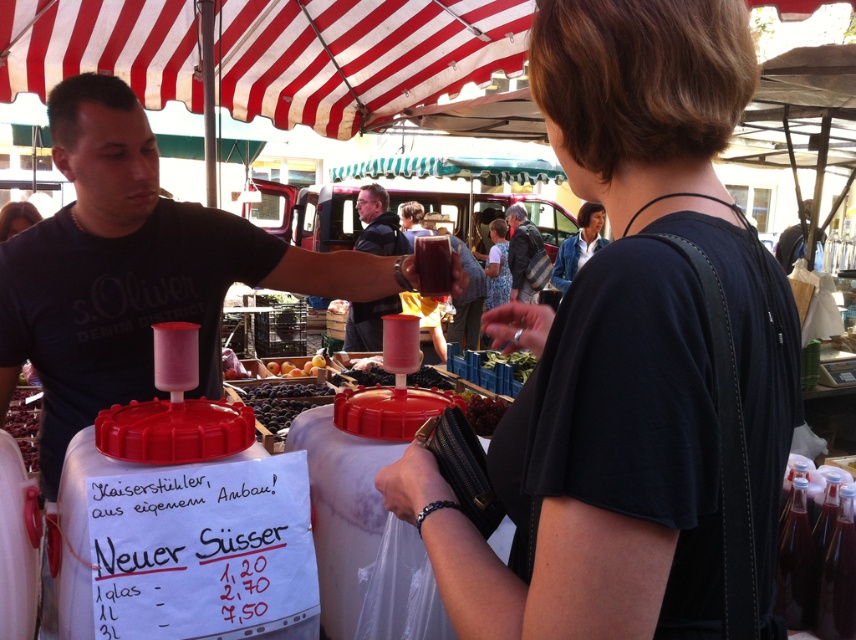
Question: Which of the following is the closest to the observer?

Choices:
 (A) dark purple grapes at center
 (B) smooth yellow peaches at center
 (C) matte black shirt at upper left

Answer: (A)

Question: Does dark blue t-shirt at center appear over matte black shirt at upper left?

Choices:
 (A) no
 (B) yes

Answer: (B)

Question: Is matte black t-shirt at center below dark purple grapes at center?

Choices:
 (A) no
 (B) yes

Answer: (A)

Question: Is dark purple grapes at center to the left of green leafy vegetable at center from the viewer's perspective?

Choices:
 (A) yes
 (B) no

Answer: (A)

Question: Which point is closer to the camera?

Choices:
 (A) dark purple grapes at center
 (B) green leafy vegetable at center
 (C) shiny plastic grapes at center

Answer: (C)

Question: Which object is the closest to the dark purple grapes at center?

Choices:
 (A) striped fabric shirt at center
 (B) blue denim jacket at upper center

Answer: (B)